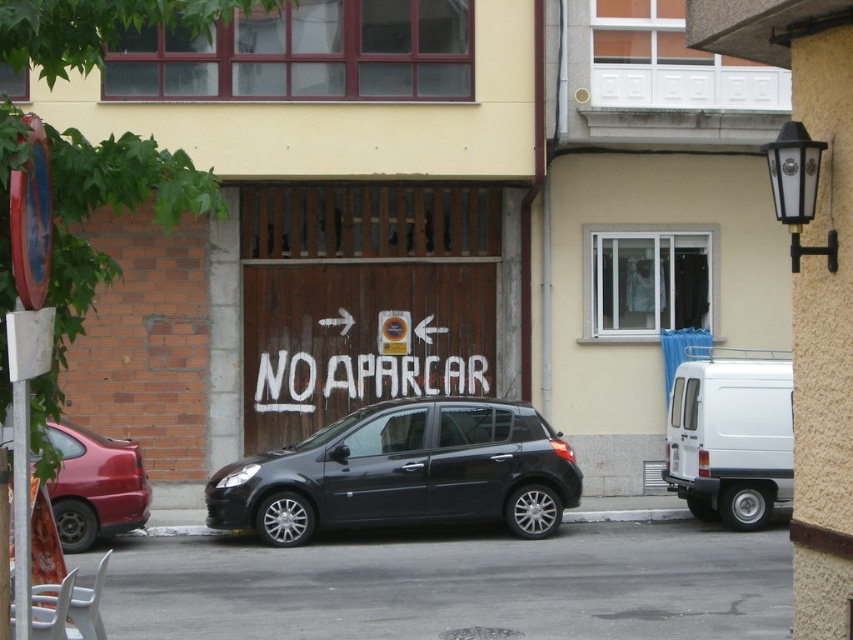
You are a delivery driver who needs to park a truck that is 6 meters long. You see the white matte van at right and the metallic red car at left parked on the street. Is there enough space between them to park your truck without moving any vehicles?

The distance between the white matte van at right and the metallic red car at left is 6.25 meters. Since the truck is 6 meters long, there is sufficient space to park between them without moving any vehicles.

You are a delivery person trying to load a tall package into your vehicle. The package is 1.8 meters tall. You have a black metallic car at center and a white matte van at right. Which vehicle should you choose to ensure the package fits inside?

The black metallic car at center has a lesser height compared to the white matte van at right. Therefore, the white matte van at right is taller and can accommodate the 1.8 meters tall package better.

You are a delivery person who needs to load a tall package into your van. You see the black metallic car at center and the metallic red car at left parked nearby. Which car should you avoid parking next to to ensure there is enough vertical clearance for your tall package?

You should avoid parking next to the black metallic car at center because it has a greater height compared to the metallic red car at left, which means there is less vertical clearance available.